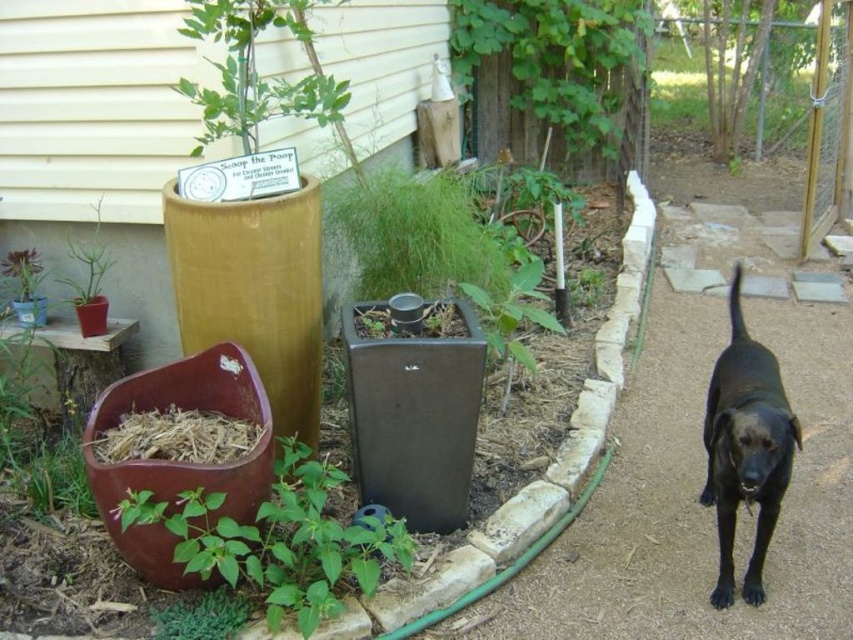
Question: Which point appears farthest from the camera in this image?

Choices:
 (A) (466, 493)
 (B) (106, 307)
 (C) (39, 308)
 (D) (369, 589)

Answer: (C)

Question: Which of the following is the farthest from the observer?

Choices:
 (A) green leafy plant at lower center
 (B) matte plastic pot at lower left
 (C) matte brown pot at lower left
 (D) burgundy matte flower bed at lower left

Answer: (C)

Question: Is green leafy plant at upper center positioned behind black matte dog at right?

Choices:
 (A) yes
 (B) no

Answer: (A)

Question: Is matte black planter at center thinner than black matte dog at right?

Choices:
 (A) yes
 (B) no

Answer: (B)

Question: Does matte black planter at center appear on the left side of matte brown pot at lower left?

Choices:
 (A) yes
 (B) no

Answer: (B)

Question: Which object appears farthest from the camera in this image?

Choices:
 (A) black matte dog at right
 (B) green leafy plant at upper center
 (C) burgundy matte flower bed at lower left

Answer: (B)